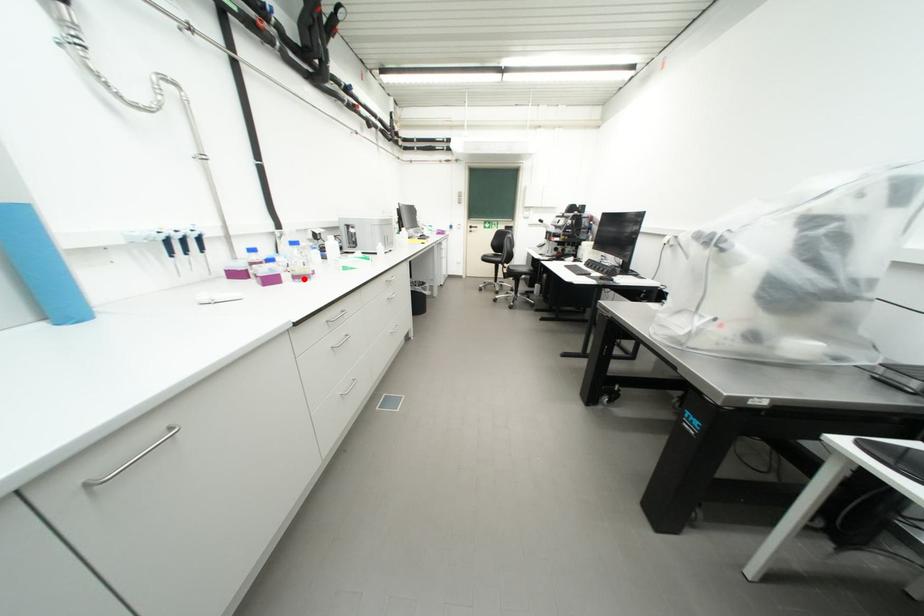
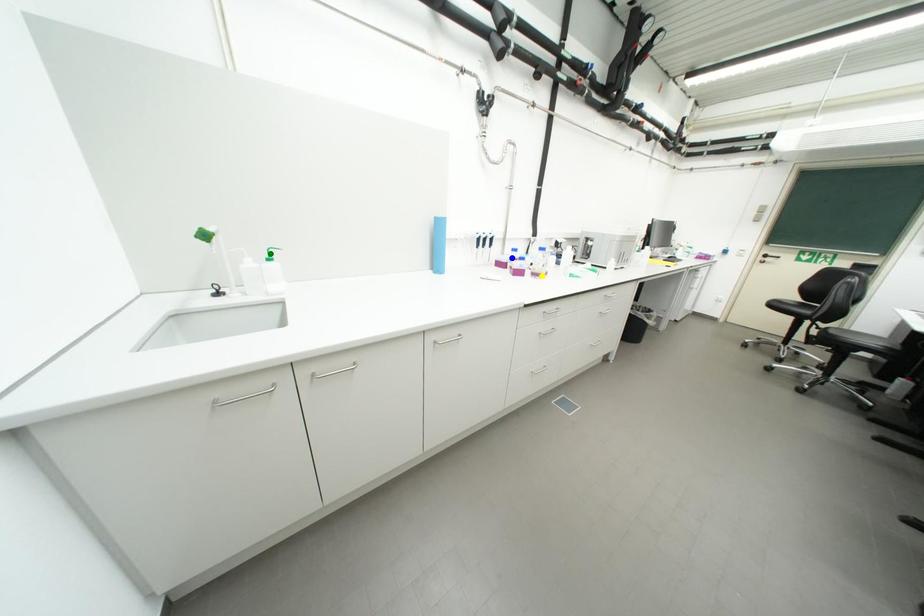
Question: I am providing you with two images of the same scene from different viewpoints. A red point is marked on the first image. You are given multiple points on the second image. In image 2, which mark is for the same physical point as the one in image 1?

Choices:
 (A) blue point
 (B) green point
 (C) yellow point

Answer: (C)